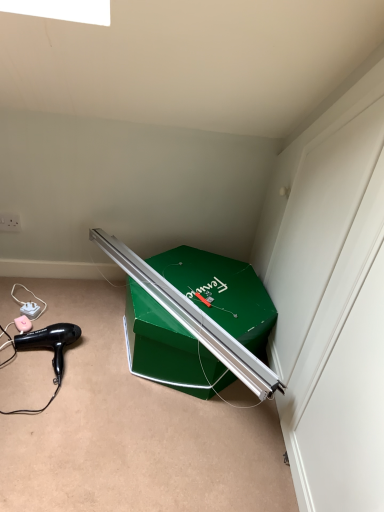
Question: Is black plastic hair dryer at lower left wider or thinner than green cardboard box at center?

Choices:
 (A) thin
 (B) wide

Answer: (A)

Question: Is black plastic hair dryer at lower left spatially inside green cardboard box at center, or outside of it?

Choices:
 (A) outside
 (B) inside

Answer: (A)

Question: Considering the positions of black plastic hair dryer at lower left and green cardboard box at center in the image, is black plastic hair dryer at lower left taller or shorter than green cardboard box at center?

Choices:
 (A) short
 (B) tall

Answer: (A)

Question: Which is correct: green cardboard box at center is inside black plastic hair dryer at lower left, or outside of it?

Choices:
 (A) outside
 (B) inside

Answer: (A)

Question: Is green cardboard box at center taller or shorter than black plastic hair dryer at lower left?

Choices:
 (A) short
 (B) tall

Answer: (B)

Question: In the image, is green cardboard box at center positioned in front of or behind black plastic hair dryer at lower left?

Choices:
 (A) front
 (B) behind

Answer: (A)

Question: From the image's perspective, relative to black plastic hair dryer at lower left, is green cardboard box at center above or below?

Choices:
 (A) above
 (B) below

Answer: (A)